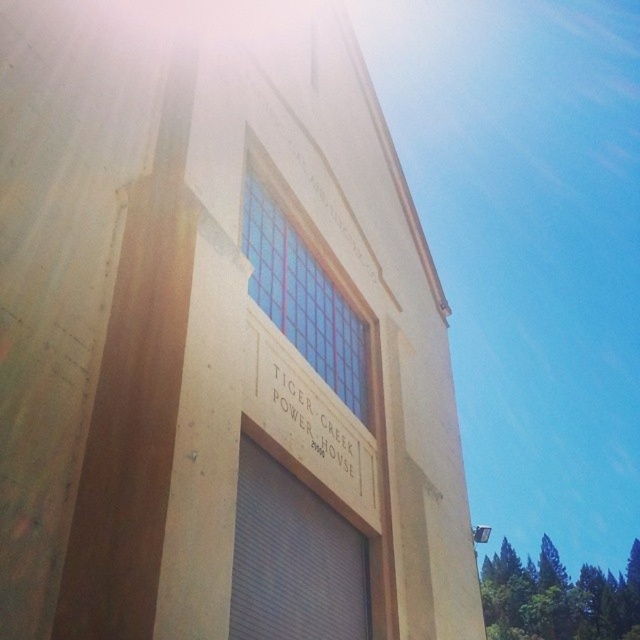
Question: Which of the following is the closest to the observer?

Choices:
 (A) (236, 525)
 (B) (333, 465)

Answer: (A)

Question: Does gray metallic garage door at center appear on the left side of white wood tiger creek power house at center?

Choices:
 (A) no
 (B) yes

Answer: (B)

Question: Is gray metallic garage door at center thinner than white wood tiger creek power house at center?

Choices:
 (A) no
 (B) yes

Answer: (A)

Question: Which point is farther from the camera taking this photo?

Choices:
 (A) coord(259,380)
 (B) coord(348,637)

Answer: (B)

Question: In this image, where is gray metallic garage door at center located relative to white wood tiger creek power house at center?

Choices:
 (A) left
 (B) right

Answer: (A)

Question: Which of the following is the closest to the observer?

Choices:
 (A) gray metallic garage door at center
 (B) white wood tiger creek power house at center

Answer: (A)